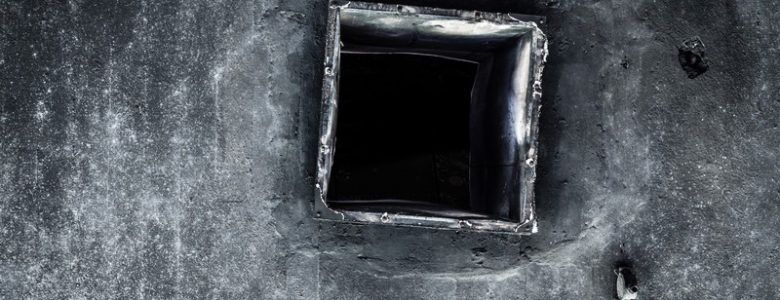
Identify the location of bumps in wall. The height and width of the screenshot is (300, 780). (477, 252), (526, 247), (562, 113), (363, 256), (324, 236).